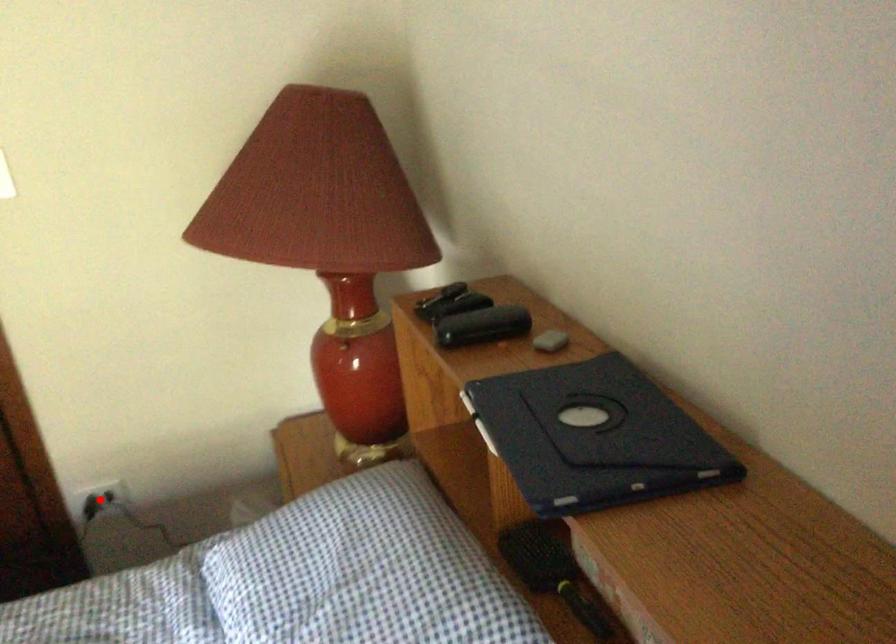
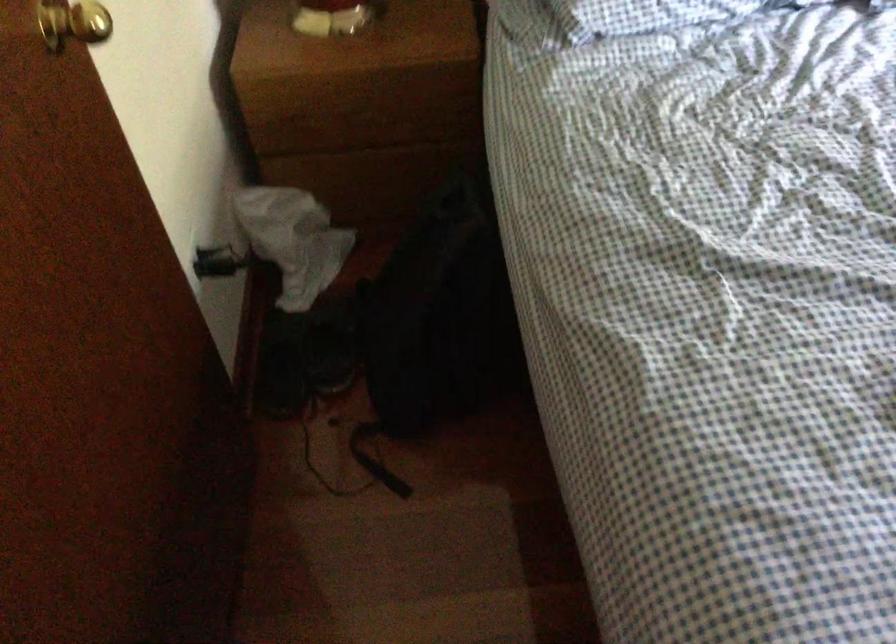
Question: I am providing you with two images of the same scene from different viewpoints. A red point is marked on the first image. Can you still see the location of the red point in image 2?

Choices:
 (A) Yes
 (B) No

Answer: (B)